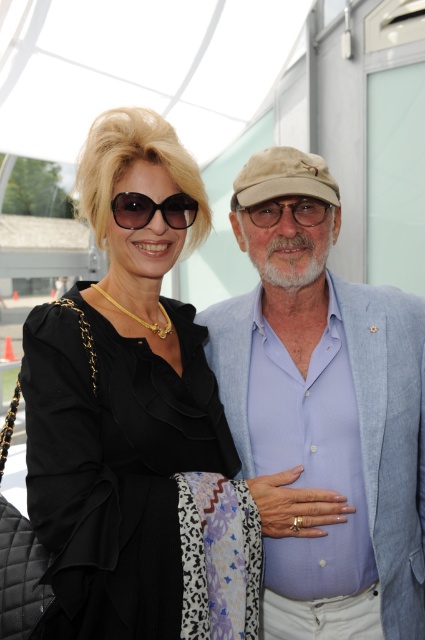
Question: Which object is positioned closest to the black satin dress at center?

Choices:
 (A) light blue cotton shirt at center
 (B) matte black sunglasses at upper left

Answer: (A)

Question: Which point is closer to the camera taking this photo?

Choices:
 (A) (113, 202)
 (B) (311, 198)
 (C) (312, 237)

Answer: (A)

Question: Is black satin dress at center positioned behind matte black sunglasses at upper left?

Choices:
 (A) no
 (B) yes

Answer: (A)

Question: Can you confirm if black satin dress at center is thinner than light blue cotton shirt at center?

Choices:
 (A) yes
 (B) no

Answer: (A)

Question: From the image, what is the correct spatial relationship of black satin dress at center in relation to matte black glasses at center?

Choices:
 (A) right
 (B) left

Answer: (B)

Question: Which point is farther to the camera?

Choices:
 (A) (314, 211)
 (B) (155, 579)

Answer: (A)